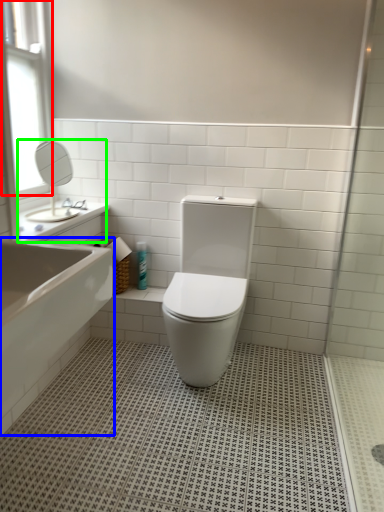
Question: Based on their relative distances, which object is farther from window (highlighted by a red box)? Choose from bath (highlighted by a blue box) and sink (highlighted by a green box).

Choices:
 (A) bath
 (B) sink

Answer: (A)